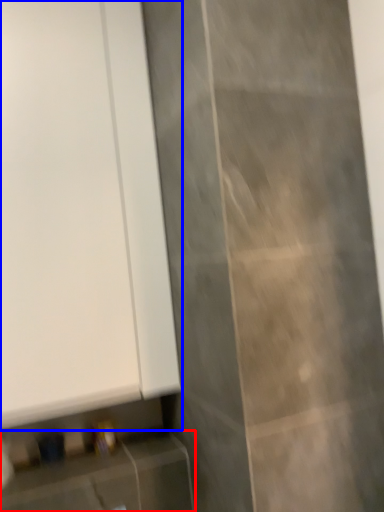
Question: Which object appears farthest to the camera in this image, cabinetry (highlighted by a red box) or door (highlighted by a blue box)?

Choices:
 (A) cabinetry
 (B) door

Answer: (B)